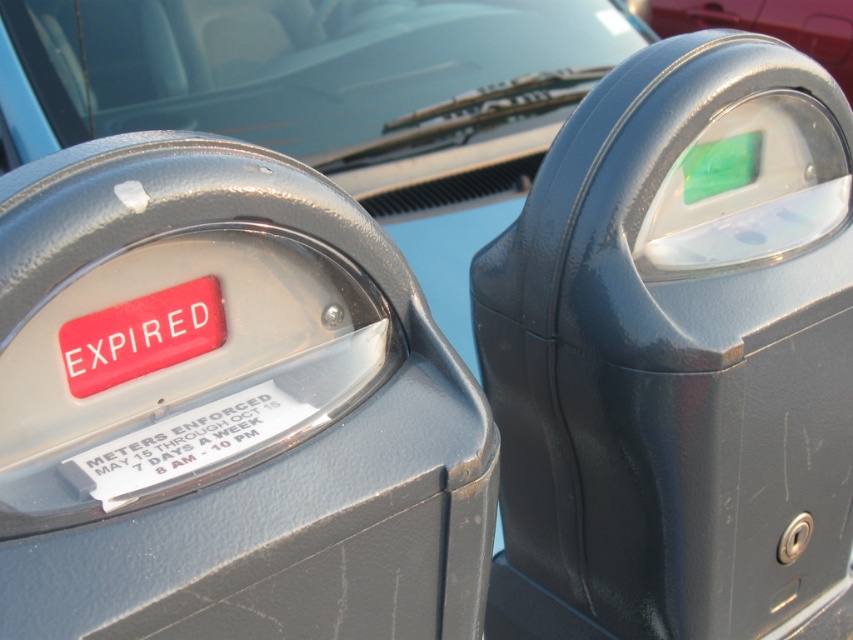
You are a driver who just parked your car and need to pay for parking. You see a matte gray parking meter at left and a glossy plastic parking meter at center. Which parking meter should you use to ensure your parking is valid during the enforced period?

You should use the glossy plastic parking meter at center because the matte gray parking meter at left is expired, as indicated by the red EXPIRED sticker mentioned in the scene description. The expired meter has a label stating enforcement dates, but since it is expired, the valid one would be the glossy plastic parking meter at center.

Based on the photo, you are a driver trying to park your car and see the glossy plastic parking meter at center and the transparent glass windshield at upper center. Which object is nearer to you?

The glossy plastic parking meter at center is closer to the viewer than the transparent glass windshield at upper center.